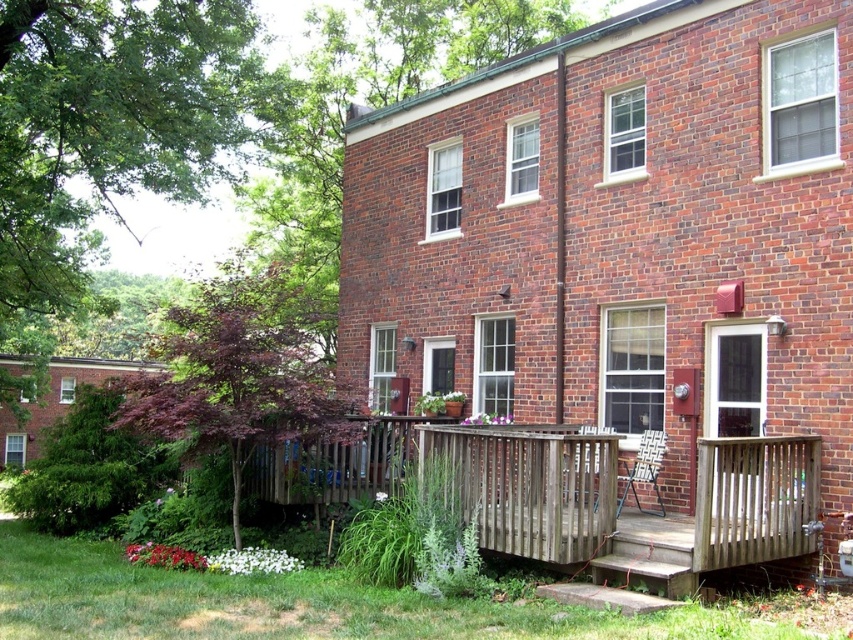
Looking at this image, is weathered wood porch at center positioned before weathered wood railing at lower center?

No.

Does point (705, 516) come farther from viewer compared to point (613, 515)?

No, (705, 516) is closer to viewer.

The image size is (853, 640). What do you see at coordinates (572, 492) in the screenshot?
I see `weathered wood porch at center` at bounding box center [572, 492].

Locate an element on the screen. weathered wood porch at center is located at coordinates (572, 492).